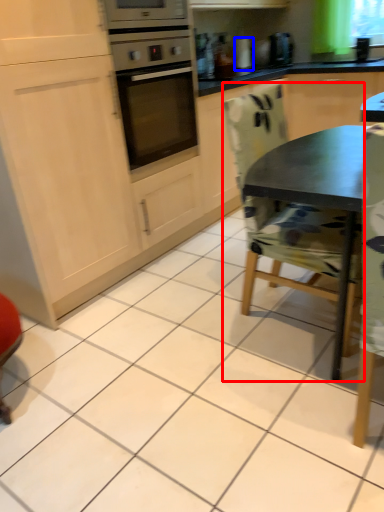
Question: Which of the following is the farthest to the observer, chair (highlighted by a red box) or appliance (highlighted by a blue box)?

Choices:
 (A) chair
 (B) appliance

Answer: (B)